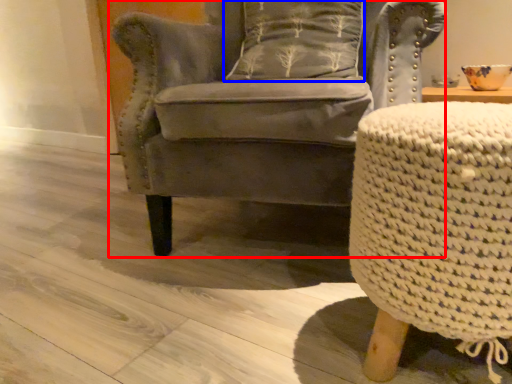
Question: Among these objects, which one is nearest to the camera, chair (highlighted by a red box) or pillow (highlighted by a blue box)?

Choices:
 (A) chair
 (B) pillow

Answer: (A)